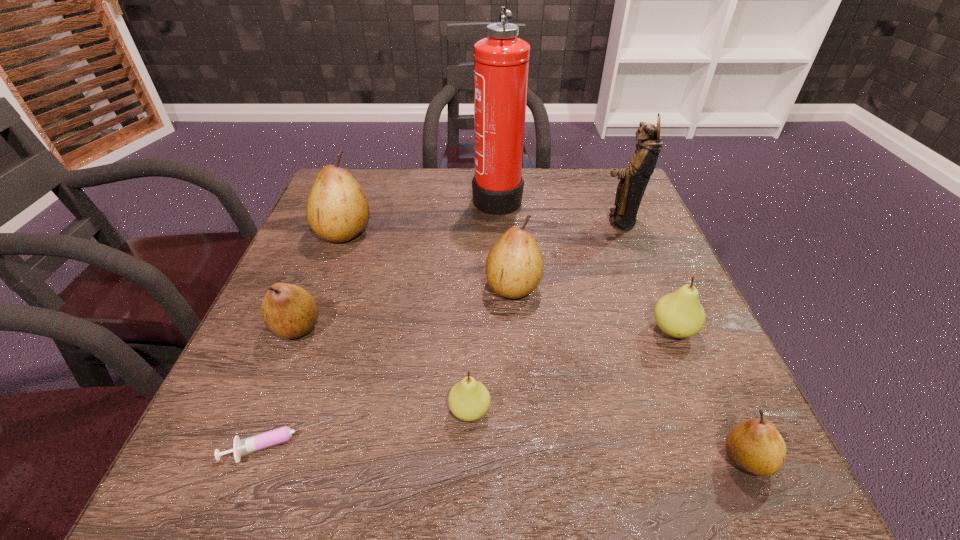
Where is `free space located on the front-facing side of the second tallest object`? This screenshot has height=540, width=960. free space located on the front-facing side of the second tallest object is located at coordinates (562, 221).

Find the location of a particular element. The width and height of the screenshot is (960, 540). vacant space positioned on the front-facing side of the second tallest object is located at coordinates (526, 221).

Where is `vacant space positioned on the right of the tallest pear`? The width and height of the screenshot is (960, 540). vacant space positioned on the right of the tallest pear is located at coordinates (397, 232).

Where is `vacant space located on the back of the third nearest brown pear`? vacant space located on the back of the third nearest brown pear is located at coordinates (506, 202).

Locate an element on the screen. The width and height of the screenshot is (960, 540). vacant space positioned 0.300m on the right of the third farthest brown pear is located at coordinates point(477,327).

At what (x,y) coordinates should I click in order to perform the action: click on free space located 0.240m on the front of the bigger green pear. Please return your answer as a coordinate pair (x, y). Looking at the image, I should click on (737, 480).

Where is `vacant space located 0.230m on the back of the nearer green pear`? This screenshot has height=540, width=960. vacant space located 0.230m on the back of the nearer green pear is located at coordinates (472, 298).

This screenshot has height=540, width=960. What are the coordinates of `free point located on the back of the nearest brown pear` in the screenshot? It's located at (661, 274).

Where is `vacant space located 0.050m on the front of the white syringe`? The width and height of the screenshot is (960, 540). vacant space located 0.050m on the front of the white syringe is located at coordinates (256, 503).

Find the location of a particular element. fire extinguisher situated at the far edge is located at coordinates [x=501, y=61].